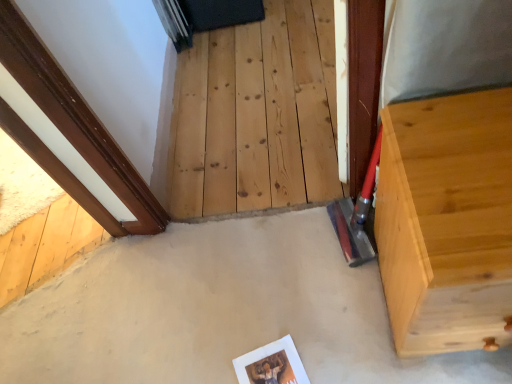
This screenshot has width=512, height=384. I want to click on vacant space in natural wood stairwell at center (from a real-world perspective), so (x=245, y=96).